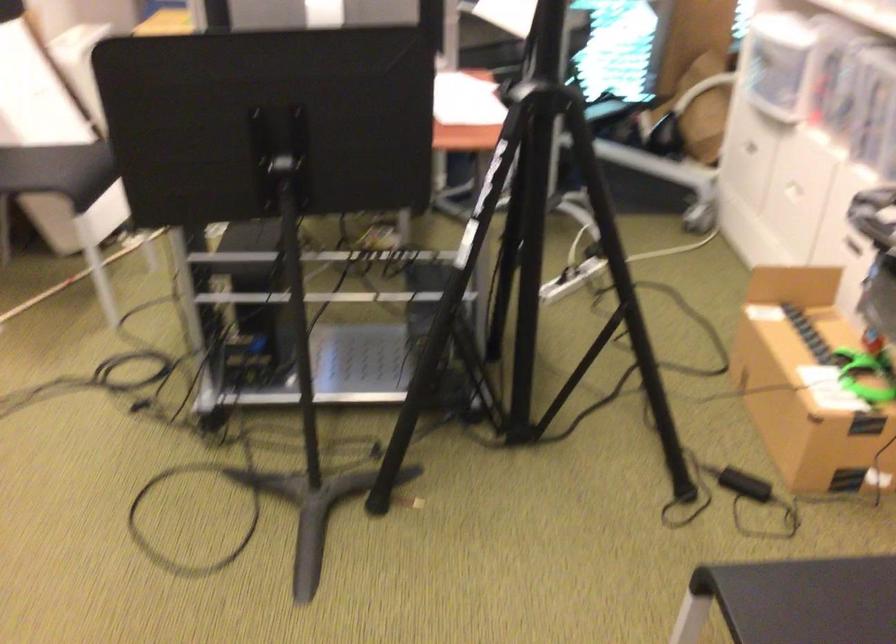
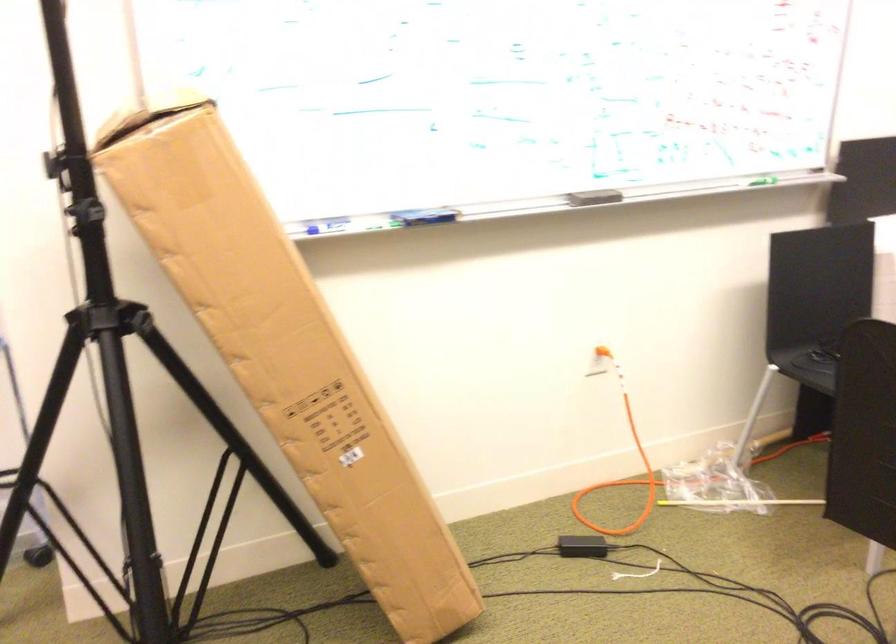
Question: How did the camera likely rotate?

Choices:
 (A) Left
 (B) Right
 (C) Up
 (D) Down

Answer: (A)